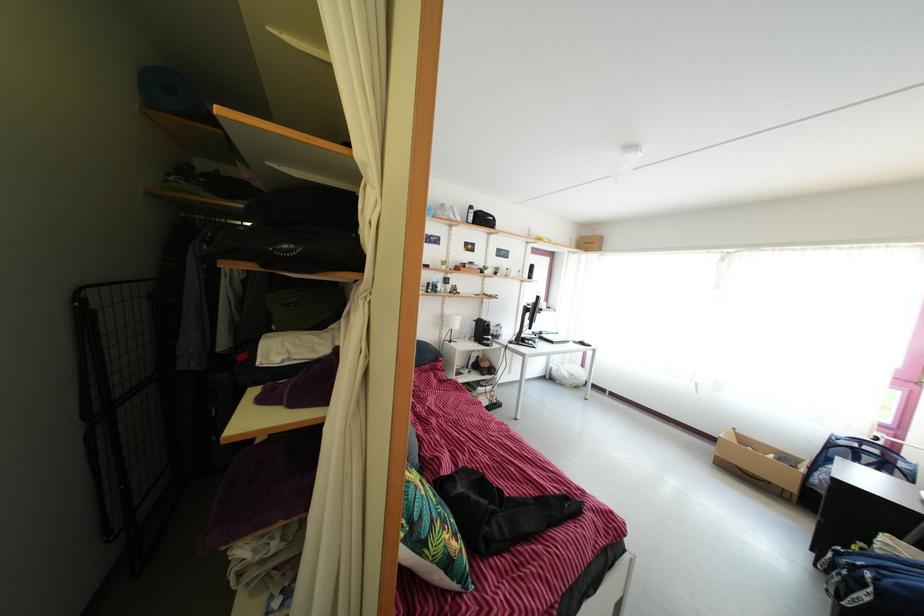
Where would you lift the white desk lamp? Please return your answer as a coordinate pair (x, y).

(450, 326)